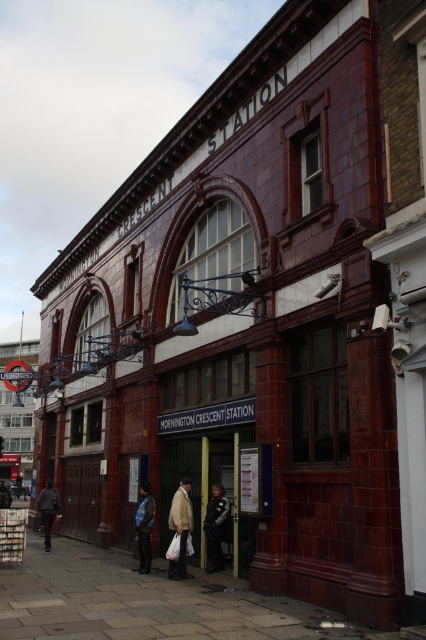
Question: Which object is closer to the camera taking this photo?

Choices:
 (A) light beige jacket at center
 (B) blue reflective jacket at center

Answer: (A)

Question: Can you confirm if dark blue uniform at center is positioned above dark gray jacket at lower left?

Choices:
 (A) yes
 (B) no

Answer: (A)

Question: Does light beige jacket at center have a greater width compared to dark gray jacket at lower left?

Choices:
 (A) yes
 (B) no

Answer: (B)

Question: Which object appears closest to the camera in this image?

Choices:
 (A) dark gray jacket at lower left
 (B) dark blue jacket at center
 (C) light beige jacket at center
 (D) paved stone sidewalk at lower center

Answer: (D)

Question: Is dark gray jacket at lower left wider than dark blue jacket at center?

Choices:
 (A) yes
 (B) no

Answer: (B)

Question: Among these points, which one is farthest from the camera?

Choices:
 (A) (149, 580)
 (B) (184, 573)
 (C) (212, 524)
 (D) (140, 545)

Answer: (D)